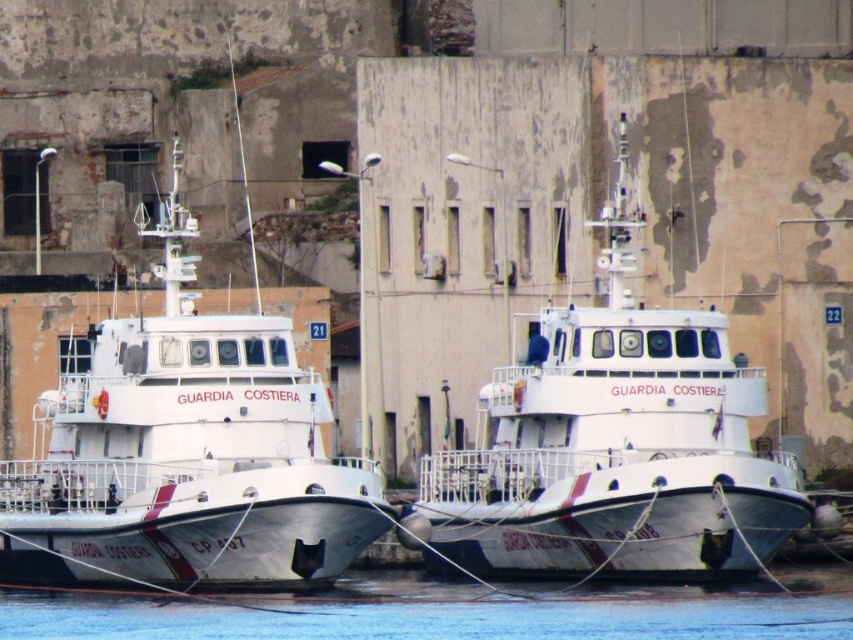
Question: Which of the following is the farthest from the observer?

Choices:
 (A) blue water at lower center
 (B) white glossy boat at center

Answer: (B)

Question: Does white glossy boat at left appear over blue water at lower center?

Choices:
 (A) no
 (B) yes

Answer: (B)

Question: Which point is farther to the camera?

Choices:
 (A) (811, 611)
 (B) (477, 545)
 (C) (270, 525)

Answer: (B)

Question: Can you confirm if white glossy boat at left is smaller than blue water at lower center?

Choices:
 (A) no
 (B) yes

Answer: (A)

Question: Which point is closer to the camera?

Choices:
 (A) blue water at lower center
 (B) white glossy boat at left

Answer: (A)

Question: Does white glossy boat at center have a lesser width compared to blue water at lower center?

Choices:
 (A) yes
 (B) no

Answer: (A)